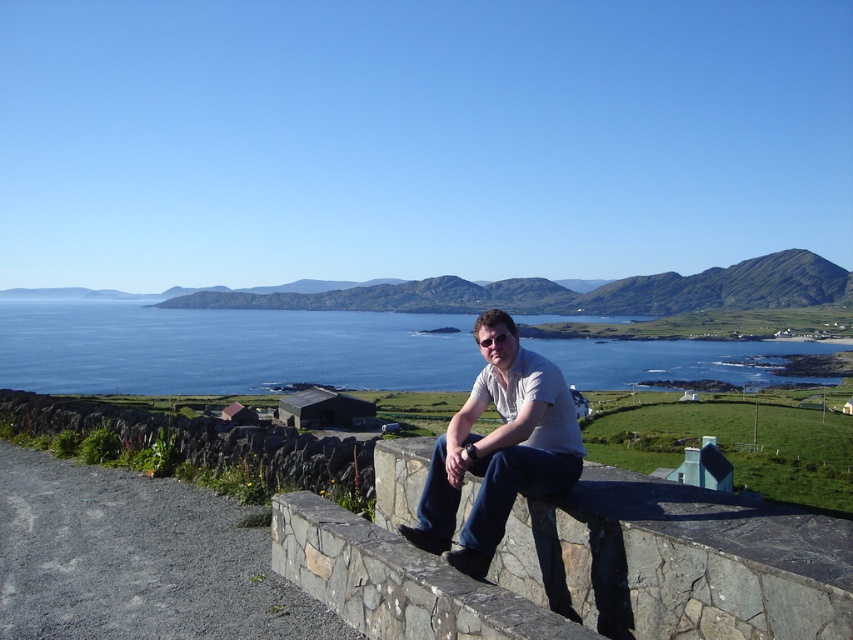
You are standing at the man sitting on a stone wall in the foreground. You want to walk directly to the blue water at center. Which direction should you walk?

You should walk forward towards the blue water at center because it is located at point [225,348], which is directly ahead of your position on the stone wall.

You are a photographer positioned at the man sitting on the stone wall. You want to take a photo of the blue water at center while ensuring the white cotton shirt at center is visible in the background. Is this possible?

The white cotton shirt at center is behind the blue water at center, so yes, you can take a photo of the blue water at center with the white cotton shirt at center visible in the background.

You are standing in the coastal landscape scene and want to walk from point A to point B. Point A is at coordinates point (297,314) and point B is at coordinates point (498,369). Since you want to avoid getting too close to the camera, which direction should you move towards when going from point A to point B?

To avoid getting too close to the camera, you should move towards point B from point A because point A is further to the camera than point B. Moving from A to B takes you away from the camera.